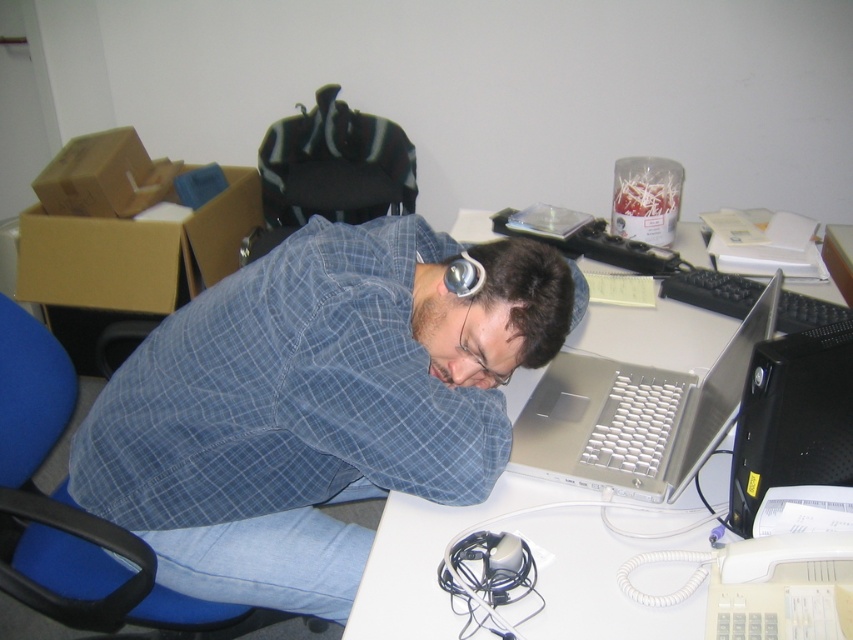
Question: Does blue plaid shirt at center come behind black plastic desktop computer at right?

Choices:
 (A) yes
 (B) no

Answer: (A)

Question: Can you confirm if blue plaid shirt at center is thinner than silver metallic laptop at center?

Choices:
 (A) no
 (B) yes

Answer: (A)

Question: Which of the following is the closest to the observer?

Choices:
 (A) silver metallic laptop at center
 (B) white plastic computer desk at center
 (C) blue plaid shirt at center

Answer: (B)

Question: Does white plastic computer desk at center lie in front of black plastic desktop computer at right?

Choices:
 (A) yes
 (B) no

Answer: (B)

Question: Estimate the real-world distances between objects in this image. Which object is farther from the white plastic computer desk at center?

Choices:
 (A) black plastic desktop computer at right
 (B) blue plaid shirt at center

Answer: (B)

Question: Which point is farther to the camera?

Choices:
 (A) white plastic computer desk at center
 (B) black plastic desktop computer at right
 (C) blue plaid shirt at center

Answer: (C)